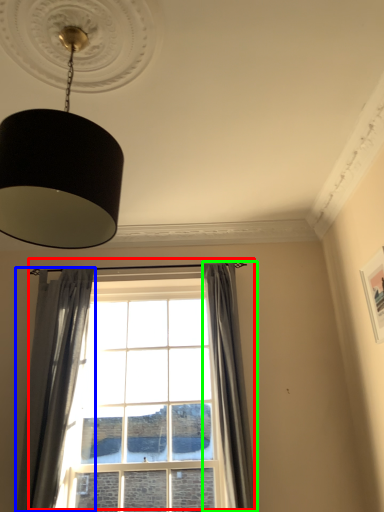
Question: Which object is positioned farthest from window (highlighted by a red box)? Select from curtain (highlighted by a blue box) and curtain (highlighted by a green box).

Choices:
 (A) curtain
 (B) curtain

Answer: (A)